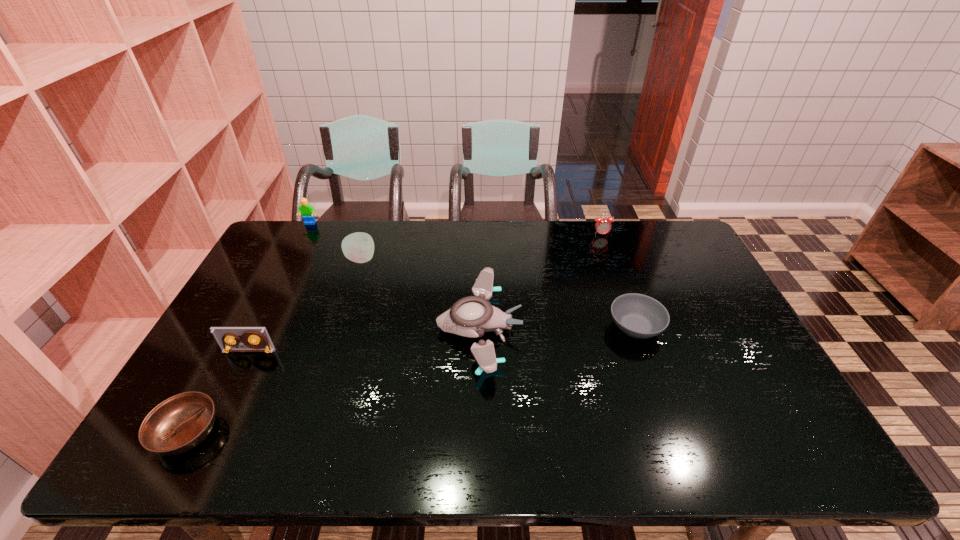
Locate an element on the screen. The height and width of the screenshot is (540, 960). the farthest object is located at coordinates (308, 213).

You are a GUI agent. You are given a task and a screenshot of the screen. Output one action in this format:
    pyautogui.click(x=<x>, y=<y>)
    Task: Click on the fourth object from left to right
    
    Given the screenshot: What is the action you would take?
    pyautogui.click(x=358, y=247)

At what (x,y) coordinates should I click in order to perform the action: click on the third farthest object. Please return your answer as a coordinate pair (x, y). The width and height of the screenshot is (960, 540). Looking at the image, I should click on (358, 247).

At what (x,y) coordinates should I click in order to perform the action: click on the sixth nearest object. Please return your answer as a coordinate pair (x, y). The height and width of the screenshot is (540, 960). Looking at the image, I should click on (602, 225).

Locate an element on the screen. This screenshot has height=540, width=960. videotape is located at coordinates (253, 339).

Locate an element on the screen. The width and height of the screenshot is (960, 540). the fifth object from left to right is located at coordinates (471, 316).

Locate an element on the screen. The image size is (960, 540). the farther soup bowl is located at coordinates (639, 316).

Identify the location of the nearest object. This screenshot has width=960, height=540. (178, 424).

You are a GUI agent. You are given a task and a screenshot of the screen. Output one action in this format:
    pyautogui.click(x=<x>, y=<y>)
    Task: Click on the nearer soup bowl
    
    Given the screenshot: What is the action you would take?
    pyautogui.click(x=178, y=424)

The height and width of the screenshot is (540, 960). I want to click on free space located on the face of the Lego, so click(291, 261).